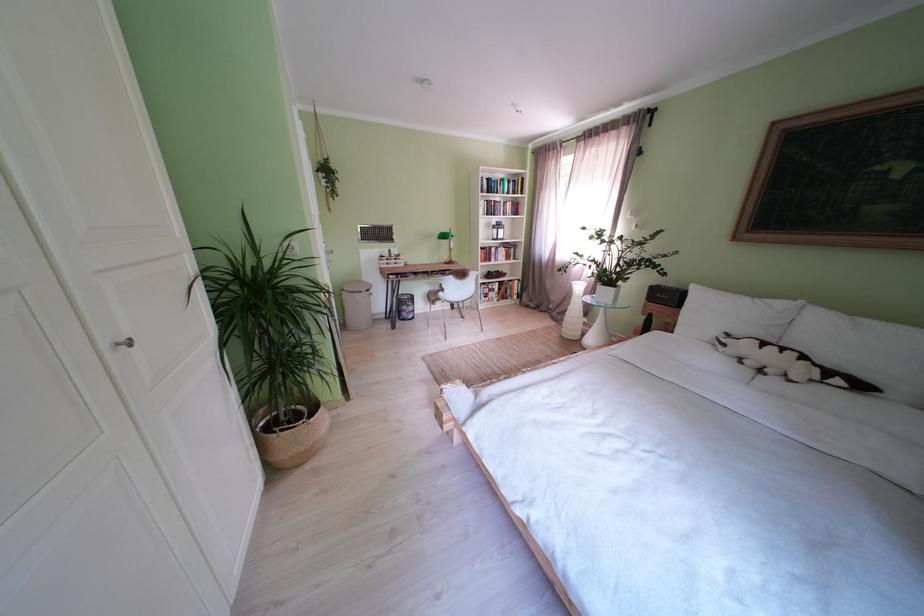
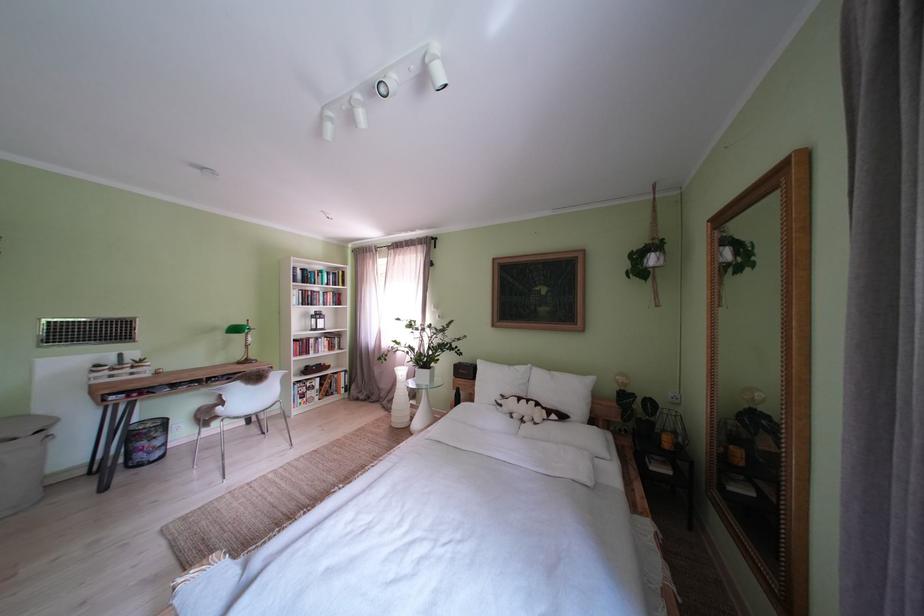
In the second image, find the point that corresponds to the point at 735,350 in the first image.

(512, 411)